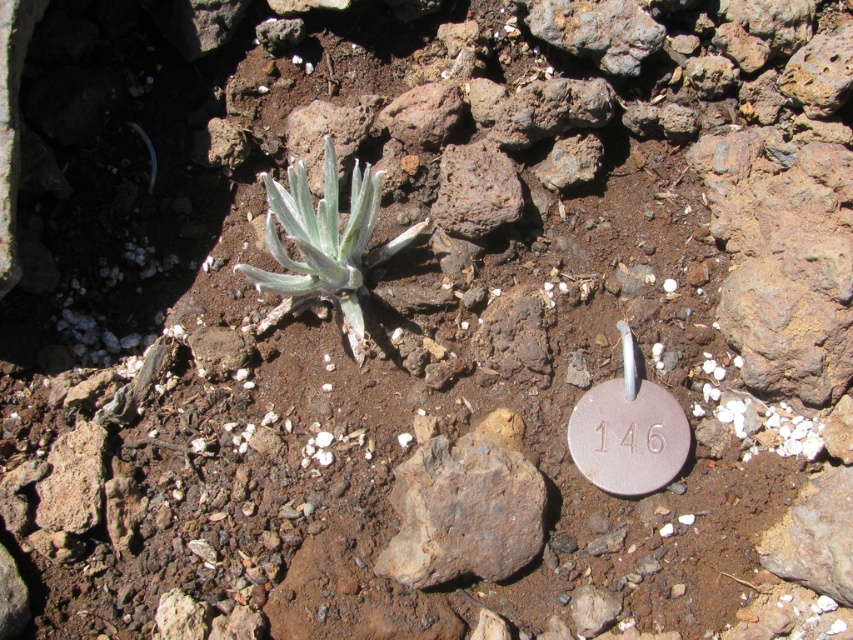
Between point (405, 499) and point (367, 188), which one is positioned in front?

Point (367, 188) is more forward.

Who is shorter, gray rough rock at center or silvery-green succulent at center?

gray rough rock at center is shorter.

This screenshot has width=853, height=640. What are the coordinates of `gray rough rock at center` in the screenshot? It's located at (463, 513).

The image size is (853, 640). What are the coordinates of `gray rough rock at center` in the screenshot? It's located at (463, 513).